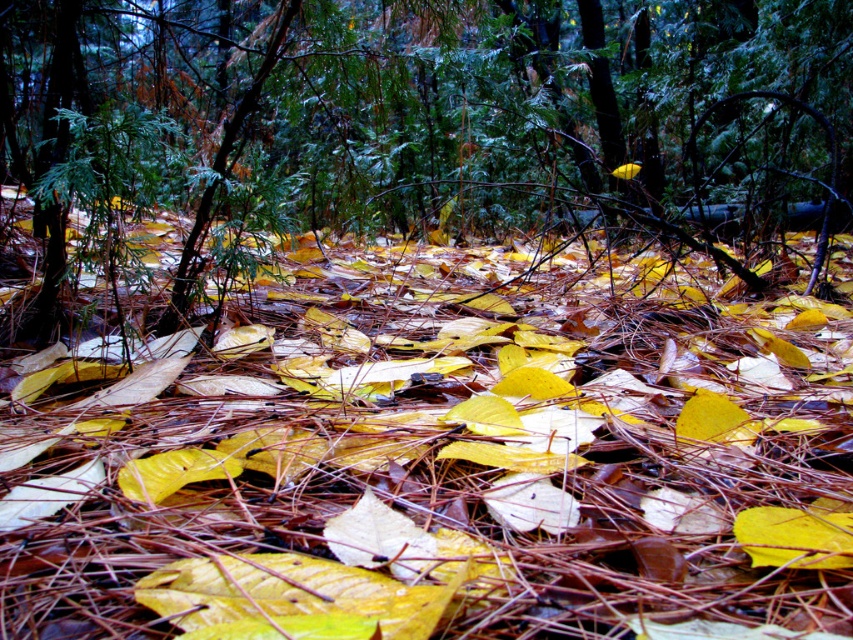
Which is above, yellow matte leaves at center or green textured pine tree at center?

Positioned higher is green textured pine tree at center.

Between point (477, 605) and point (585, 83), which one is positioned in front?

Point (477, 605) is in front.

This screenshot has width=853, height=640. What are the coordinates of `yellow matte leaves at center` in the screenshot? It's located at (444, 454).